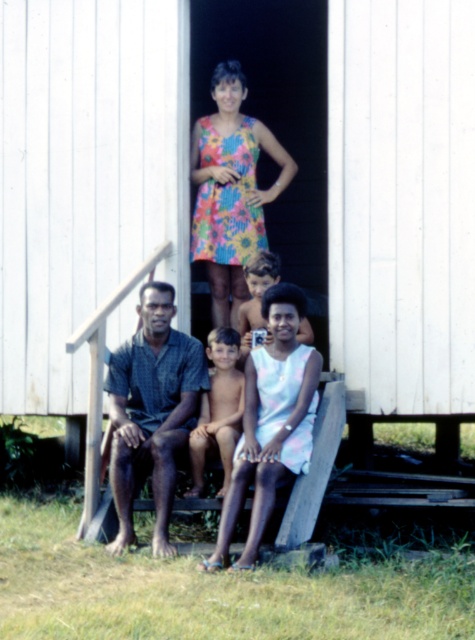
Who is taller, light brown skin at center or white cotton shirt at lower center?

light brown skin at center is taller.

Is light brown skin at center further to camera compared to white cotton shirt at lower center?

That is False.

Is point (228, 433) farther from viewer compared to point (246, 324)?

No, it is not.

Where is `light brown skin at center`? The width and height of the screenshot is (475, 640). light brown skin at center is located at coordinates (218, 410).

Does dark blue plaid shirt at lower left appear under floral dress at center?

Yes.

From the picture: Is dark blue plaid shirt at lower left shorter than floral dress at center?

Yes.

Locate an element on the screen. This screenshot has width=475, height=640. dark blue plaid shirt at lower left is located at coordinates (152, 410).

Where is `dark blue plaid shirt at lower left`? This screenshot has width=475, height=640. dark blue plaid shirt at lower left is located at coordinates (152, 410).

Is pastel floral dress at center further to camera compared to white cotton shirt at lower center?

No, pastel floral dress at center is closer to the viewer.

Is point (116, 396) closer to camera compared to point (252, 276)?

That is True.

In order to click on pastel floral dress at center in this screenshot , I will do `click(273, 429)`.